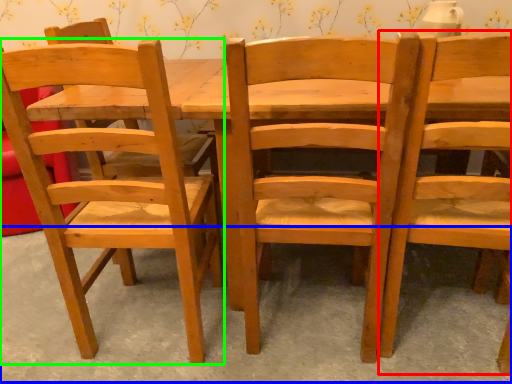
Question: Which object is the closest to the chair (highlighted by a red box)? Choose among these: concrete (highlighted by a blue box) or chair (highlighted by a green box).

Choices:
 (A) concrete
 (B) chair

Answer: (A)